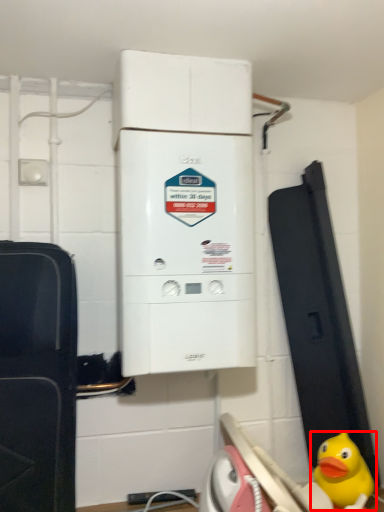
Question: Considering the relative positions of toy (annotated by the red box) and home appliance in the image provided, where is toy (annotated by the red box) located with respect to the staircase?

Choices:
 (A) right
 (B) left

Answer: (A)